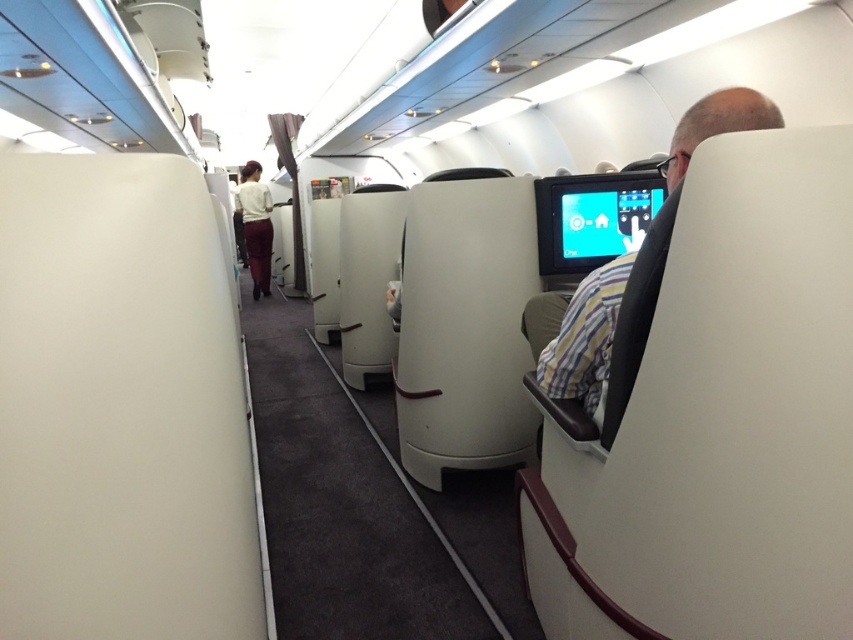
Can you confirm if striped fabric shirt at right is smaller than white fabric uniform at center?

Indeed, striped fabric shirt at right has a smaller size compared to white fabric uniform at center.

Find the location of a particular element. The height and width of the screenshot is (640, 853). striped fabric shirt at right is located at coordinates (576, 333).

At what (x,y) coordinates should I click in order to perform the action: click on striped fabric shirt at right. Please return your answer as a coordinate pair (x, y). This screenshot has width=853, height=640. Looking at the image, I should click on point(576,333).